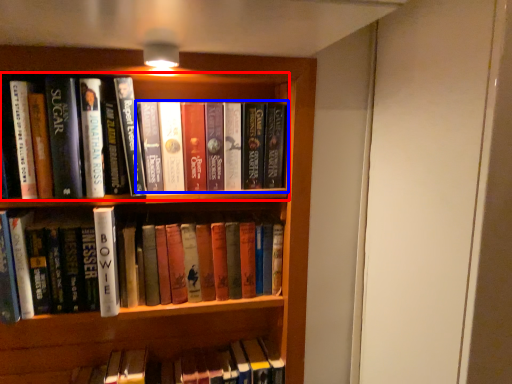
Question: Which object appears closest to the camera in this image, book (highlighted by a red box) or book (highlighted by a blue box)?

Choices:
 (A) book
 (B) book

Answer: (A)